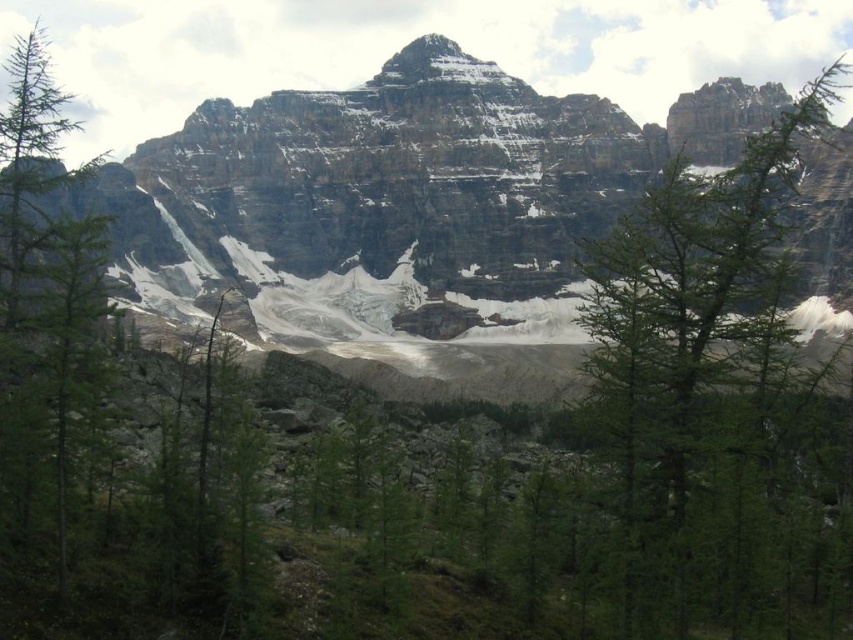
Which is more to the right, green needle-like tree at upper right or green matte tree at left?

Positioned to the right is green needle-like tree at upper right.

Between point (807, 385) and point (41, 29), which one is positioned in front?

Positioned in front is point (807, 385).

Describe the element at coordinates (692, 346) in the screenshot. I see `green needle-like tree at upper right` at that location.

Find the location of a particular element. The height and width of the screenshot is (640, 853). green needle-like tree at upper right is located at coordinates (692, 346).

Which is above, rocky mountain at center or green matte tree at left?

rocky mountain at center is above.

Describe the element at coordinates (397, 202) in the screenshot. I see `rocky mountain at center` at that location.

What are the coordinates of `rocky mountain at center` in the screenshot? It's located at (397, 202).

Is rocky mountain at center further to the viewer compared to green needle-like tree at upper right?

Yes, it is.

Can you confirm if rocky mountain at center is positioned above green needle-like tree at upper right?

Yes, rocky mountain at center is above green needle-like tree at upper right.

Locate an element on the screen. rocky mountain at center is located at coordinates (397, 202).